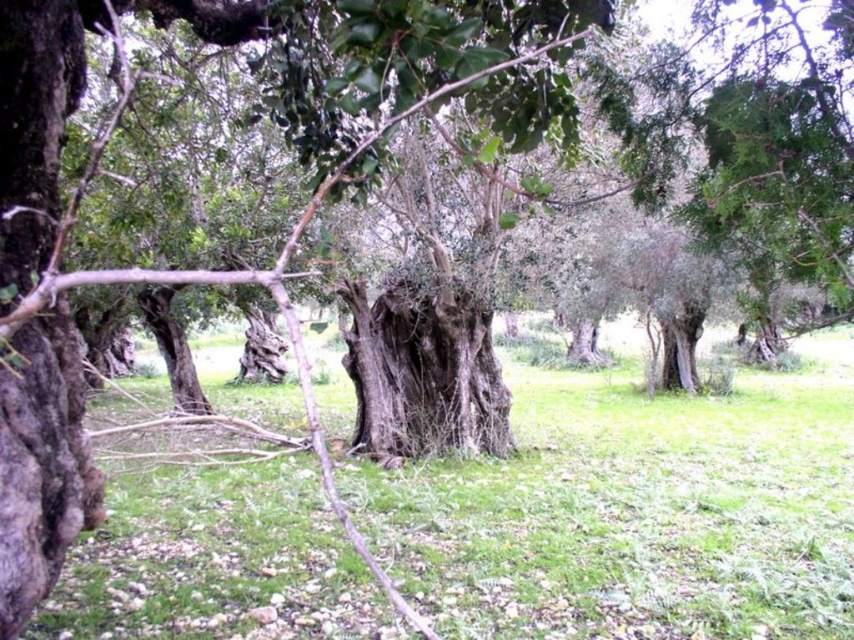
Looking at this image, is green grass at center wider than rough bark tree trunk at center?

Yes.

Which is more to the right, green grass at center or rough bark tree trunk at center?

Positioned to the right is green grass at center.

Is point (536, 572) positioned before point (493, 390)?

Yes, it is in front of point (493, 390).

At what (x,y) coordinates should I click in order to perform the action: click on green grass at center. Please return your answer as a coordinate pair (x, y). The image size is (854, 640). Looking at the image, I should click on (635, 509).

Between green grass at center and dark brown rough bark at left, which one appears on the right side from the viewer's perspective?

Positioned to the right is green grass at center.

Measure the distance between green grass at center and camera.

green grass at center and camera are 2.79 meters apart from each other.

Who is more distant from viewer, (342,605) or (22,237)?

Positioned behind is point (342,605).

Identify the location of green grass at center. The width and height of the screenshot is (854, 640). (635, 509).

Find the location of a particular element. Image resolution: width=854 pixels, height=640 pixels. dark brown rough bark at left is located at coordinates (39, 461).

Which is in front, point (82, 512) or point (410, 422)?

Point (82, 512)

Image resolution: width=854 pixels, height=640 pixels. Find the location of `dark brown rough bark at left`. dark brown rough bark at left is located at coordinates (39, 461).

Where is `dark brown rough bark at left`? The height and width of the screenshot is (640, 854). dark brown rough bark at left is located at coordinates (39, 461).